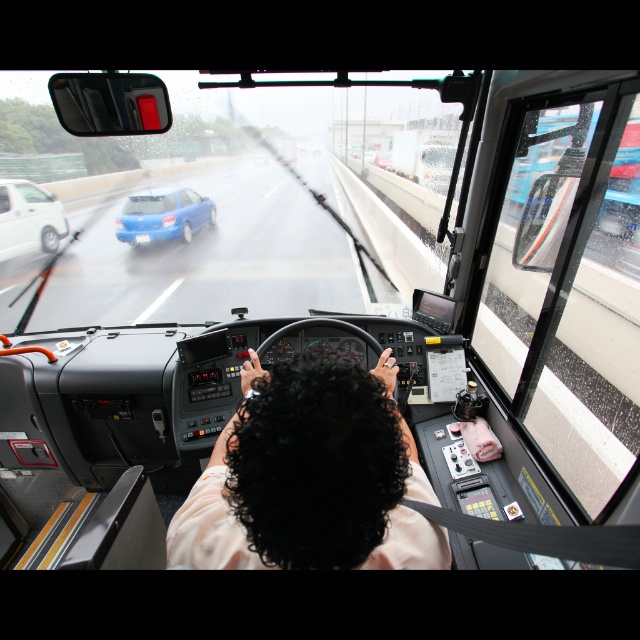
You are a passenger sitting in the front seat of the bus. You notice two points marked on the windshield. The first point is at coordinates point (310,259), and the second point is at coordinates point (189,198). Which point is closer to your eyes?

Point (310,259) is closer to the camera than point (189,198), so the first point is closer to your eyes.

You are a passenger sitting in the front seat of the bus. You want to hand the driver a bottle located on the dashboard. Which object is closer to you, the dark curly hair at center or the white matte sedan at left?

The dark curly hair at center is closer to you because it is positioned to the right of the white matte sedan at left, meaning it is nearer in the driver seat perspective.

You are a passenger sitting in the front seat of the bus. You notice two objects in your view. One is the dark curly hair at center and the other is the white matte sedan at left. Which object takes up more space in your view?

The white matte sedan at left takes up more space in your view because the dark curly hair at center occupies less space than the white matte sedan at left.